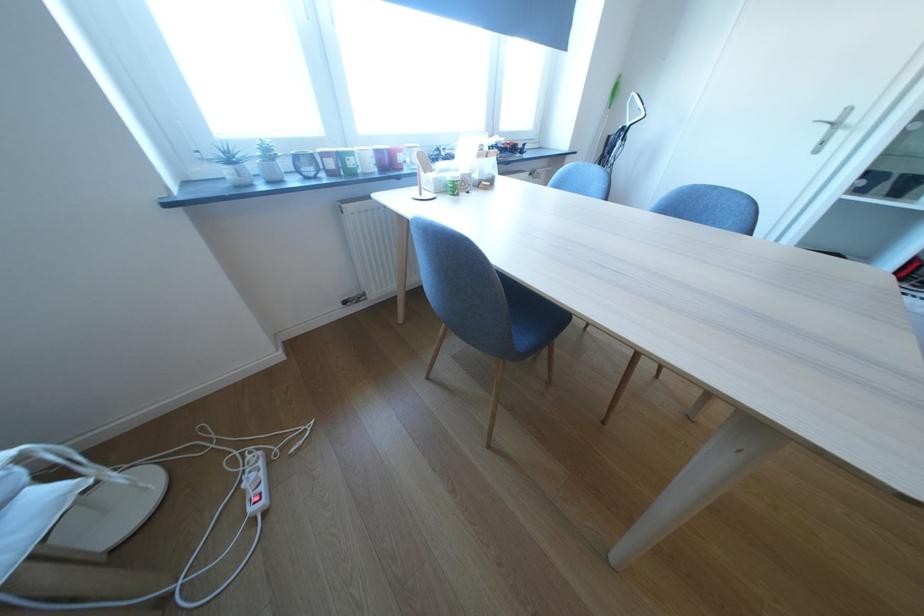
Describe the element at coordinates (365, 159) in the screenshot. I see `the white candle jar` at that location.